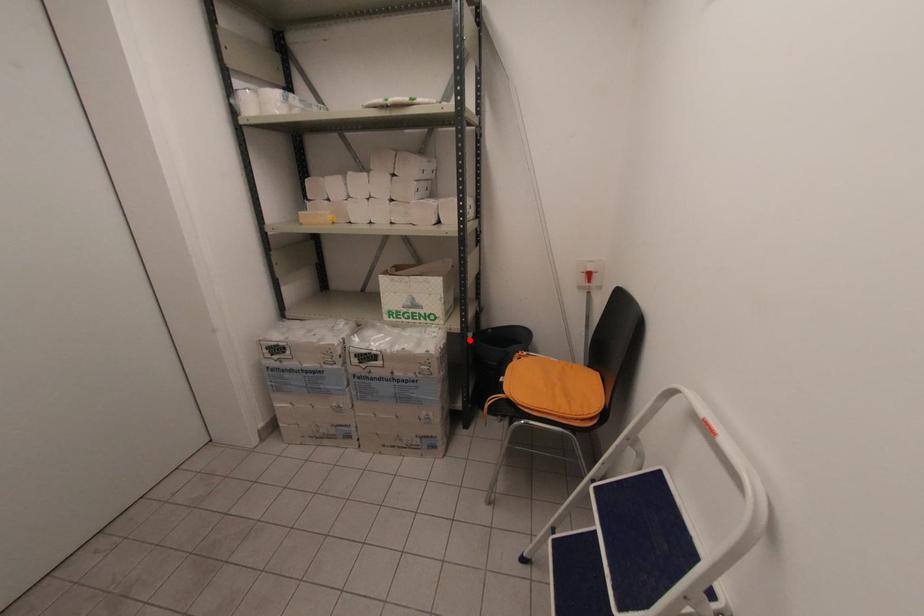
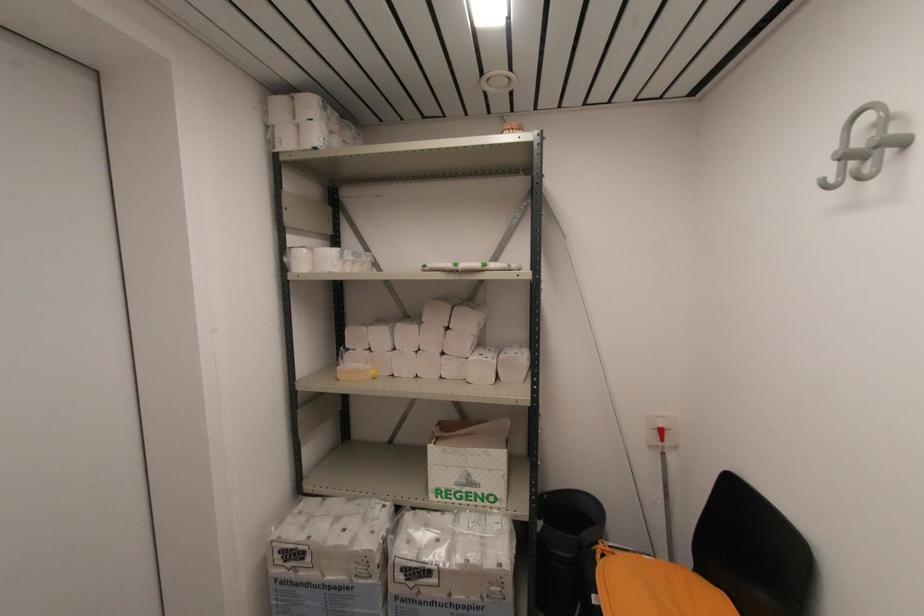
Question: I am providing you with two images of the same scene from different viewpoints. Image1 has a red point marked. In image2, the corresponding 3D location appears at what relative position? Reply with the corresponding letter.

Choices:
 (A) Closer
 (B) Farther

Answer: (B)